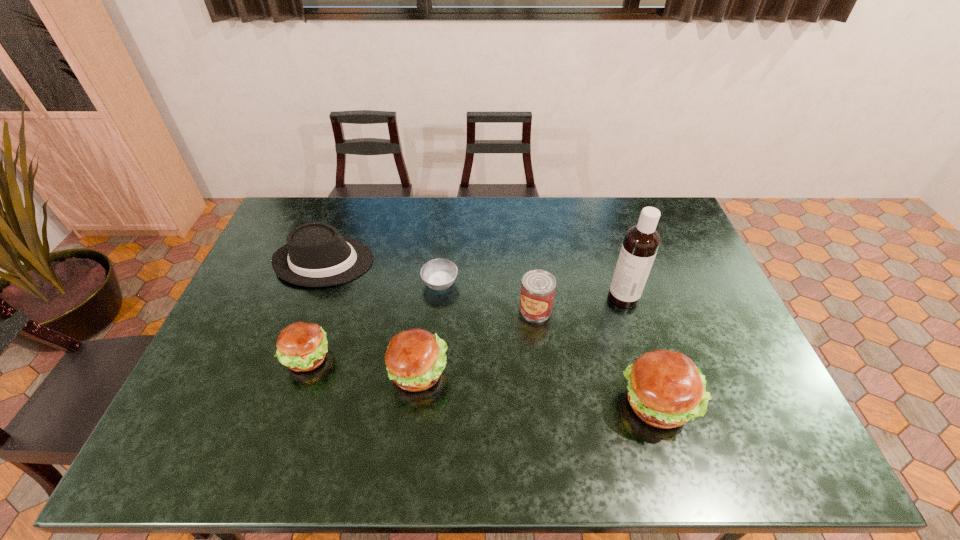
Where is `free space located on the right of the shortest object`? The width and height of the screenshot is (960, 540). free space located on the right of the shortest object is located at coordinates (557, 283).

The height and width of the screenshot is (540, 960). In order to click on vacant space positioned on the label side of the dishwasher detergent in this screenshot , I will do `click(572, 298)`.

Where is `free region located on the label side of the dishwasher detergent`? This screenshot has width=960, height=540. free region located on the label side of the dishwasher detergent is located at coordinates pyautogui.click(x=565, y=298).

Where is `free spot located on the label side of the dishwasher detergent`? free spot located on the label side of the dishwasher detergent is located at coordinates (563, 298).

At what (x,y) coordinates should I click in order to perform the action: click on blank area located 0.310m on the front-facing side of the fedora. Please return your answer as a coordinate pair (x, y). This screenshot has width=960, height=540. Looking at the image, I should click on click(x=467, y=261).

Locate an element on the screen. This screenshot has height=540, width=960. vacant space located 0.240m on the front of the fifth object from left to right is located at coordinates (545, 395).

Where is `object present at the far edge`? object present at the far edge is located at coordinates (315, 255).

Image resolution: width=960 pixels, height=540 pixels. I want to click on object that is at the left edge, so click(315, 255).

The width and height of the screenshot is (960, 540). Find the location of `object present at the far left corner`. object present at the far left corner is located at coordinates (315, 255).

Image resolution: width=960 pixels, height=540 pixels. What are the coordinates of `vacant area at the far edge` in the screenshot? It's located at (630, 227).